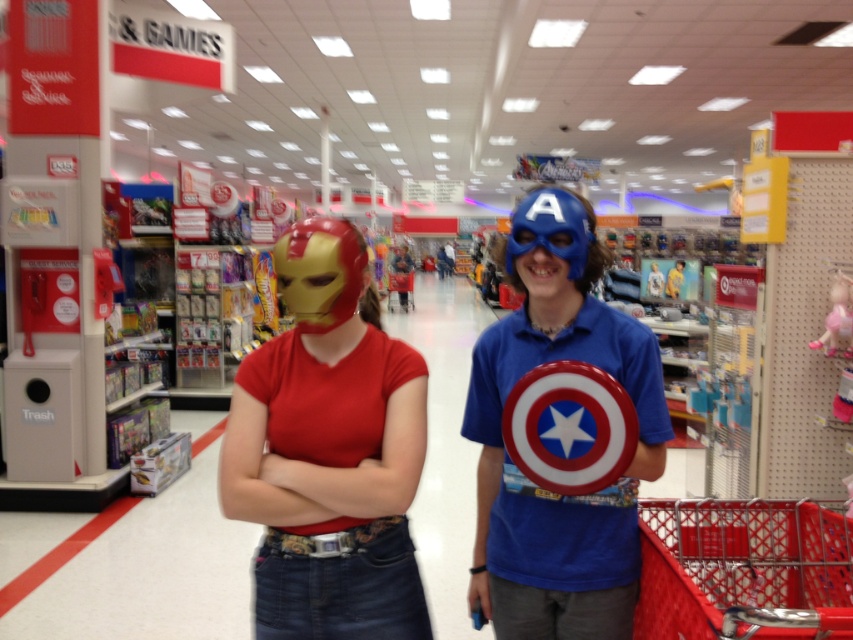
Question: Does matte gold mask at center appear over shiny metallic mask at center?

Choices:
 (A) yes
 (B) no

Answer: (B)

Question: Which of the following is the farthest from the observer?

Choices:
 (A) click(x=308, y=422)
 (B) click(x=840, y=298)
 (C) click(x=520, y=570)

Answer: (B)

Question: From the image, what is the correct spatial relationship of matte gold mask at center in relation to shiny metallic mask at center?

Choices:
 (A) below
 (B) above

Answer: (A)

Question: Which of the following is the farthest from the observer?

Choices:
 (A) (846, 284)
 (B) (537, 577)
 (C) (529, 588)
 (D) (375, 314)

Answer: (A)

Question: Can you confirm if matte gold mask at center is positioned below shiny plastic shield at center?

Choices:
 (A) yes
 (B) no

Answer: (B)

Question: Which object is farther from the camera taking this photo?

Choices:
 (A) shiny metallic mask at center
 (B) pink fabric doll at center right
 (C) shiny plastic shield at center

Answer: (B)